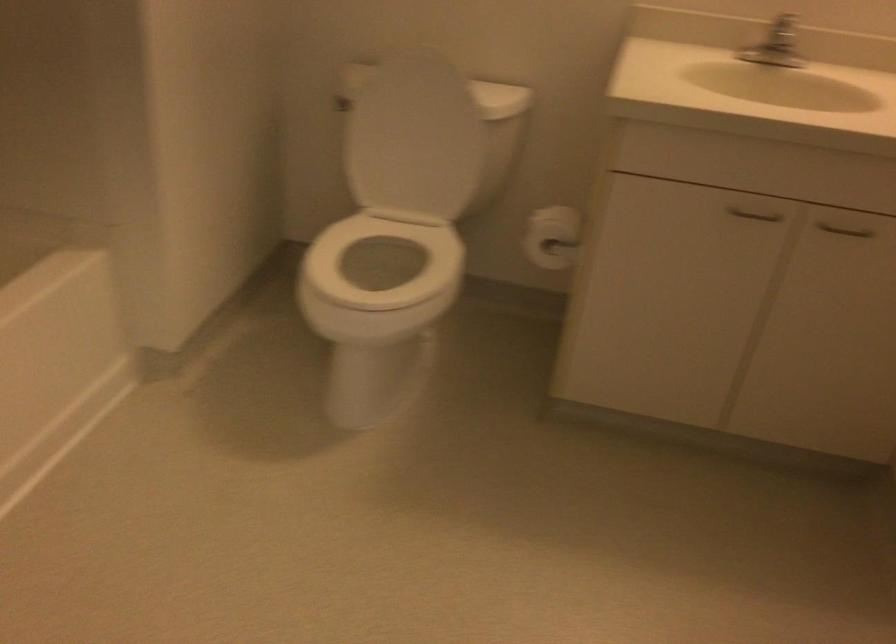
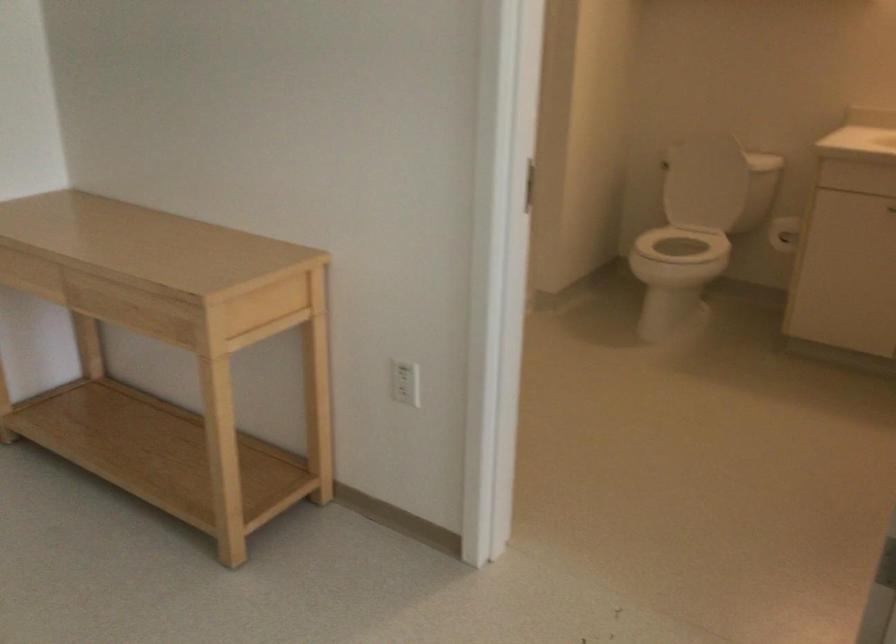
Question: The images are taken continuously from a first-person perspective. In which direction are you moving?

Choices:
 (A) Left
 (B) Right
 (C) Forward
 (D) Backward

Answer: (D)